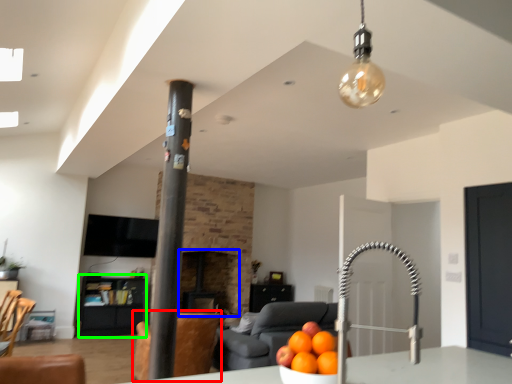
Question: Which object is positioned farthest from swivel chair (highlighted by a red box)? Select from fireplace (highlighted by a blue box) and furniture (highlighted by a green box).

Choices:
 (A) fireplace
 (B) furniture

Answer: (B)